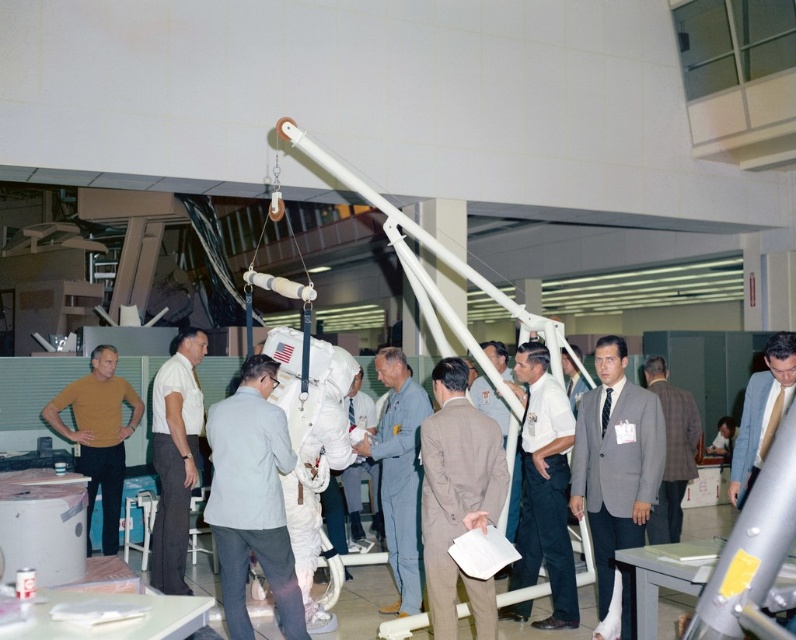
You are a technician wearing a light brown suit at center in a lab. You need to reach a control panel located 4 meters away from your current position. Can you comfortably walk to the control panel without any obstacles?

The distance between the light brown suit at center and the camera is 3.75 meters. Since the control panel is 4 meters away, it is slightly further than your current position relative to the camera. However, the scene description mentions no obstacles, so you can comfortably walk to the control panel.

A technician needs to move a tool from the point at coordinate (455, 524) to the central cylindrical object. Given that the tool is 2 meters long, can they reach the central cylindrical object without extending beyond the tool?

The distance between the point at coordinate (455, 524) and the central cylindrical object is 3.82 meters. Since the tool is only 2 meters long, the technician cannot reach the central cylindrical object without extending beyond the tool.